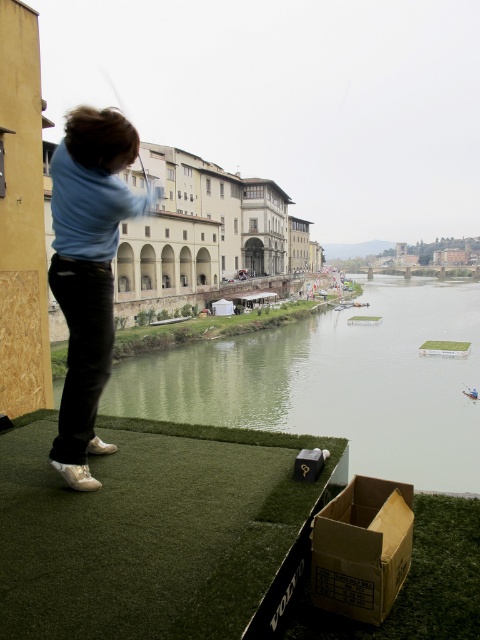
Question: Can you confirm if green smooth water at center is positioned below metallic silver golf club at upper left?

Choices:
 (A) yes
 (B) no

Answer: (A)

Question: Which point appears closest to the camera in this image?

Choices:
 (A) (73, 112)
 (B) (339, 589)
 (C) (423, 474)
 (D) (147, 182)

Answer: (B)

Question: Which point appears farthest from the camera in this image?

Choices:
 (A) (87, 324)
 (B) (402, 502)
 (C) (276, 429)

Answer: (C)

Question: In this image, where is brown cardboard box at lower right located relative to metallic silver golf club at upper left?

Choices:
 (A) left
 (B) right

Answer: (B)

Question: Is green smooth water at center in front of brown cardboard box at lower right?

Choices:
 (A) no
 (B) yes

Answer: (A)

Question: Which object is positioned farthest from the green smooth water at center?

Choices:
 (A) brown cardboard box at lower right
 (B) metallic silver golf club at upper left

Answer: (B)